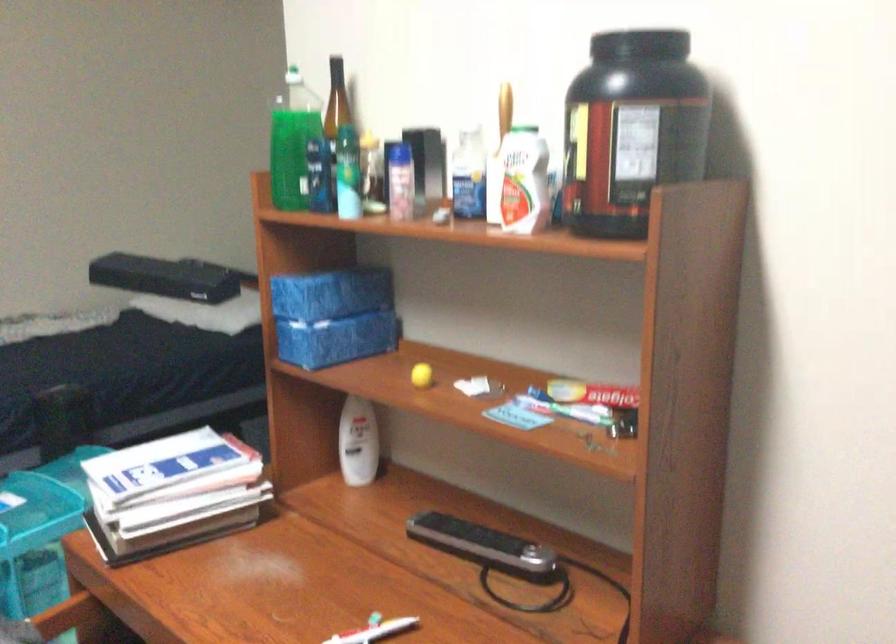
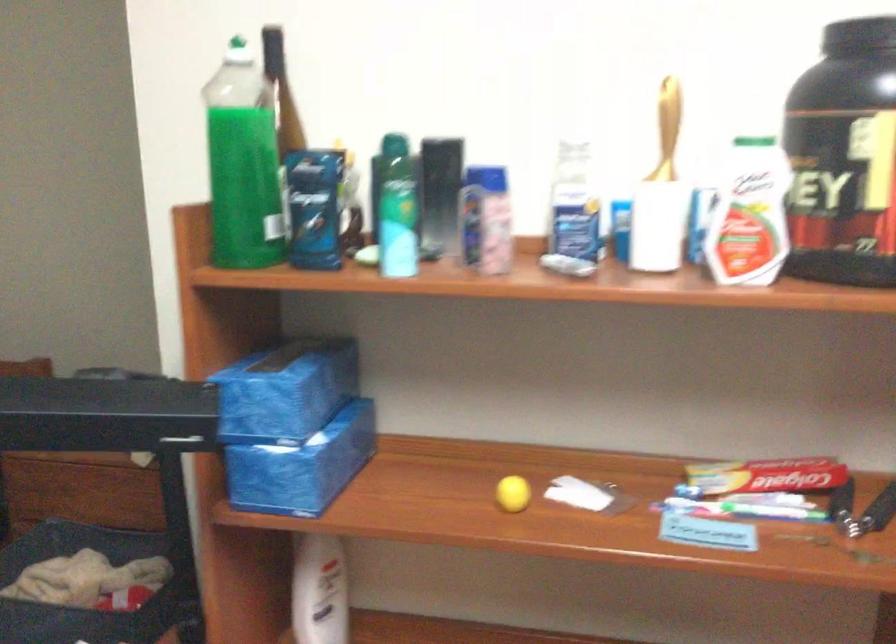
Find the pixel in the second image that matches pixel 307 146 in the first image.

(243, 163)